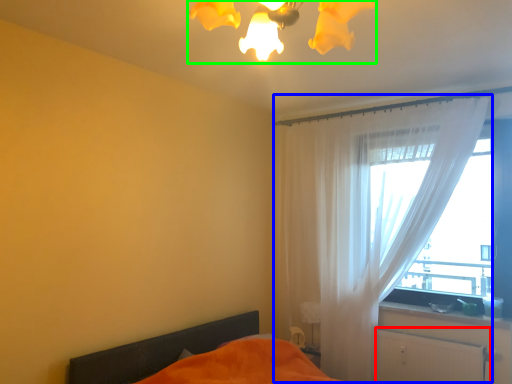
Question: Estimate the real-world distances between objects in this image. Which object is closer to radiator (highlighted by a red box), curtain (highlighted by a blue box) or light fixture (highlighted by a green box)?

Choices:
 (A) curtain
 (B) light fixture

Answer: (A)